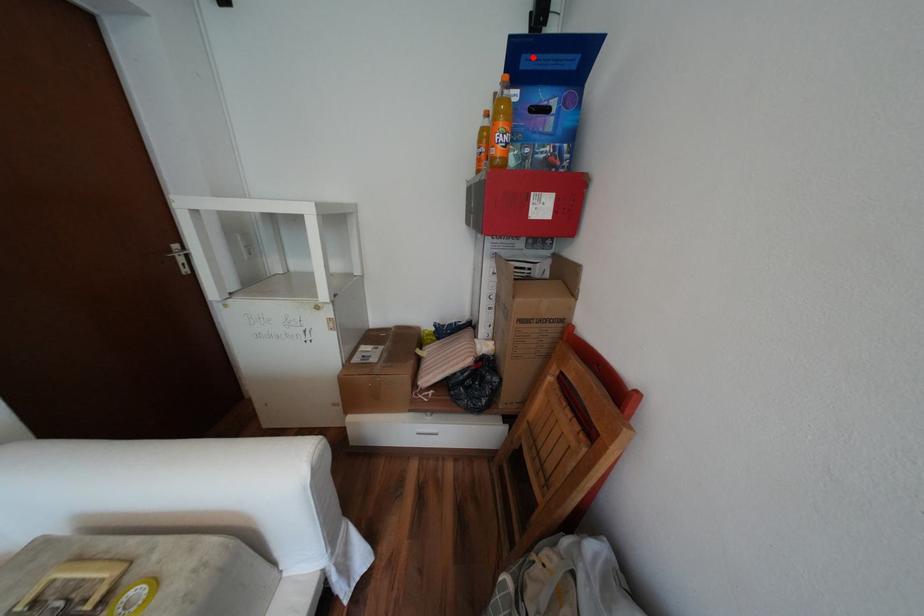
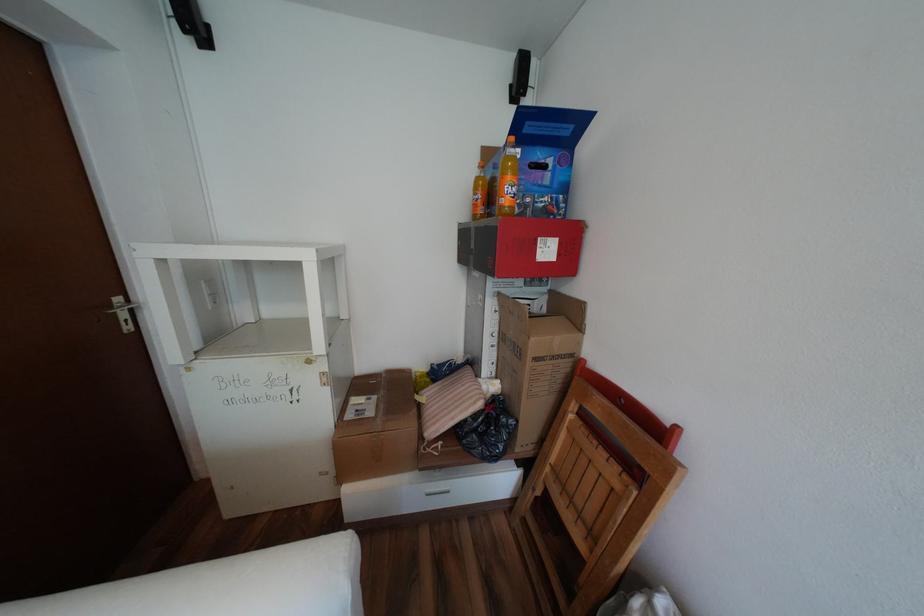
In the second image, find the point that corresponds to the highlighted location in the first image.

(537, 123)